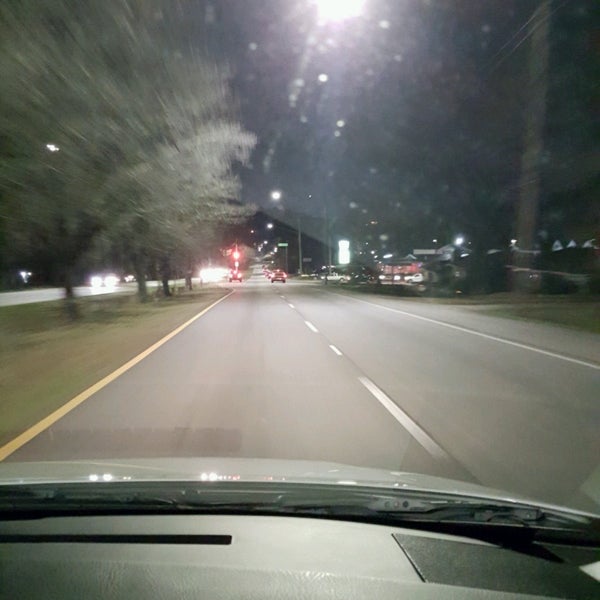
You are a GUI agent. You are given a task and a screenshot of the screen. Output one action in this format:
    pyautogui.click(x=<x>, y=<y>)
    Task: Click on the light
    
    Given the screenshot: What is the action you would take?
    pyautogui.click(x=343, y=5)